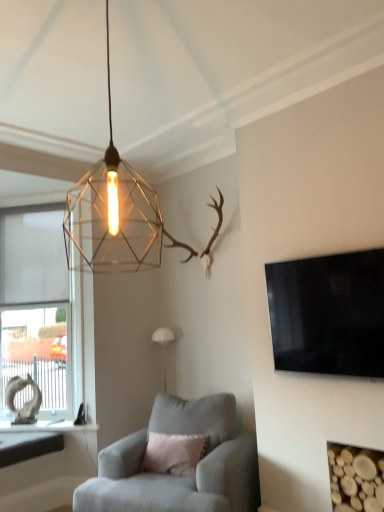
Describe the element at coordinates (38, 309) in the screenshot. The height and width of the screenshot is (512, 384). I see `white matte window at left` at that location.

In order to face metallic wireframe pendant light at upper center, positioned as the 2th lamp in bottom-to-top order, should I rotate leftwards or rightwards?

A 11.670 degree turn to the left will do.

The height and width of the screenshot is (512, 384). I want to click on wooden logs at lower right, so click(x=355, y=478).

The height and width of the screenshot is (512, 384). Find the location of `black glossy flat-screen tv at right`. black glossy flat-screen tv at right is located at coordinates (328, 314).

You are a GUI agent. You are given a task and a screenshot of the screen. Output one action in this format:
    pyautogui.click(x=<x>, y=<y>)
    Task: Click on the suede gray armchair at center
    This screenshot has height=512, width=384.
    Given the screenshot: What is the action you would take?
    pyautogui.click(x=178, y=466)

Locate an element on the screen. This screenshot has width=384, height=512. white matte window at left is located at coordinates (38, 309).

Would you say white matte lamp at center, which appears as the 1th lamp when ordered from the bottom, is part of white matte window at left's contents?

No.

Is white matte window at left to the left or to the right of white matte lamp at center, which appears as the 1th lamp when ordered from the bottom, in the image?

Clearly, white matte window at left is on the left of white matte lamp at center, which appears as the 1th lamp when ordered from the bottom, in the image.

In the scene shown: Which is less distant, (67, 365) or (163, 362)?

Point (67, 365) appears to be closer to the viewer than point (163, 362).

Is metallic wireframe pendant light at upper center, positioned as the 2th lamp in bottom-to-top order, located within black glossy flat-screen tv at right?

No, metallic wireframe pendant light at upper center, positioned as the 2th lamp in bottom-to-top order, is not a part of black glossy flat-screen tv at right.

Is black glossy flat-screen tv at right to the left or to the right of metallic wireframe pendant light at upper center, positioned as the 2th lamp in bottom-to-top order, in the image?

Based on their positions, black glossy flat-screen tv at right is located to the right of metallic wireframe pendant light at upper center, positioned as the 2th lamp in bottom-to-top order.

From the picture: Does black glossy flat-screen tv at right turn towards metallic wireframe pendant light at upper center, which is counted as the first lamp, starting from the front?

Yes, black glossy flat-screen tv at right is oriented towards metallic wireframe pendant light at upper center, which is counted as the first lamp, starting from the front.

From the image's perspective, is black glossy flat-screen tv at right located above or below metallic wireframe pendant light at upper center, the 1th lamp viewed from the top?

Based on their image positions, black glossy flat-screen tv at right is located beneath metallic wireframe pendant light at upper center, the 1th lamp viewed from the top.

Considering the relative sizes of white matte window at left and metallic wireframe pendant light at upper center, acting as the 2th lamp starting from the back, in the image provided, is white matte window at left thinner than metallic wireframe pendant light at upper center, acting as the 2th lamp starting from the back,?

Yes.

Does white matte window at left have a larger size compared to metallic wireframe pendant light at upper center, positioned as the 2th lamp in bottom-to-top order?

Correct, white matte window at left is larger in size than metallic wireframe pendant light at upper center, positioned as the 2th lamp in bottom-to-top order.

Looking at this image, which is closer to the camera, (33, 357) or (111, 244)?

The point (111, 244) is more forward.

In the image, is white matte window at left on the left side or the right side of metallic wireframe pendant light at upper center, the 1th lamp viewed from the top?

In the image, white matte window at left appears on the left side of metallic wireframe pendant light at upper center, the 1th lamp viewed from the top.

Consider the image. What's the angular difference between suede gray armchair at center and metallic wireframe pendant light at upper center, positioned as the 2th lamp in bottom-to-top order,'s facing directions?

The angle between the facing direction of suede gray armchair at center and the facing direction of metallic wireframe pendant light at upper center, positioned as the 2th lamp in bottom-to-top order, is 19.4 degrees.

Is suede gray armchair at center oriented away from metallic wireframe pendant light at upper center, acting as the 2th lamp starting from the back?

No, suede gray armchair at center is not facing the opposite direction of metallic wireframe pendant light at upper center, acting as the 2th lamp starting from the back.

Between suede gray armchair at center and metallic wireframe pendant light at upper center, which is counted as the first lamp, starting from the front, which one is positioned in front?

metallic wireframe pendant light at upper center, which is counted as the first lamp, starting from the front, is closer to the camera.

From a real-world perspective, which is physically below, suede gray armchair at center or metallic wireframe pendant light at upper center, positioned as the 2th lamp in bottom-to-top order?

From a 3D spatial view, suede gray armchair at center is below.

Does wooden logs at lower right have a smaller size compared to suede gray armchair at center?

Correct, wooden logs at lower right occupies less space than suede gray armchair at center.

Looking at this image, which object is more forward, wooden logs at lower right or suede gray armchair at center?

wooden logs at lower right is more forward.

Does wooden logs at lower right have a lesser width compared to suede gray armchair at center?

Yes, wooden logs at lower right is thinner than suede gray armchair at center.

From a real-world perspective, between wooden logs at lower right and suede gray armchair at center, who is vertically higher?

wooden logs at lower right.

Is white matte lamp at center, arranged as the first lamp when viewed from the back, turned away from suede gray armchair at center?

No, white matte lamp at center, arranged as the first lamp when viewed from the back, is not facing the opposite direction of suede gray armchair at center.

Identify the location of chair below the white matte lamp at center, placed as the 2th lamp when sorted from top to bottom (from the image's perspective). This screenshot has height=512, width=384. (178, 466).

Considering the sizes of white matte lamp at center, placed as the 2th lamp when sorted from top to bottom, and suede gray armchair at center in the image, is white matte lamp at center, placed as the 2th lamp when sorted from top to bottom, bigger or smaller than suede gray armchair at center?

In the image, white matte lamp at center, placed as the 2th lamp when sorted from top to bottom, appears to be smaller than suede gray armchair at center.

Considering the relative positions of white matte lamp at center, which appears as the 1th lamp when ordered from the bottom, and suede gray armchair at center in the image provided, is white matte lamp at center, which appears as the 1th lamp when ordered from the bottom, in front of suede gray armchair at center?

That is False.

The width and height of the screenshot is (384, 512). What are the coordinates of `lamp that is the 1st one when counting leftward from the wooden logs at lower right` in the screenshot? It's located at (163, 345).

Which of these two, wooden logs at lower right or white matte lamp at center, arranged as the first lamp when viewed from the back, stands shorter?

With less height is wooden logs at lower right.

Can white matte lamp at center, placed as the 2th lamp when sorted from top to bottom, be found inside wooden logs at lower right?

Definitely not — white matte lamp at center, placed as the 2th lamp when sorted from top to bottom, is not inside wooden logs at lower right.

Based on their positions, is wooden logs at lower right located to the left or right of white matte lamp at center, placed as the 2th lamp when sorted from top to bottom?

Based on their positions, wooden logs at lower right is located to the right of white matte lamp at center, placed as the 2th lamp when sorted from top to bottom.

The image size is (384, 512). I want to click on window that is in front of the white matte lamp at center, placed as the 2th lamp when sorted from top to bottom, so click(38, 309).

Identify the location of television below the metallic wireframe pendant light at upper center, the 1th lamp viewed from the top (from a real-world perspective). The width and height of the screenshot is (384, 512). (328, 314).

Estimate the real-world distances between objects in this image. Which object is further from white matte lamp at center, placed as the 2th lamp when sorted from top to bottom, suede gray armchair at center or metallic wireframe pendant light at upper center, which is counted as the first lamp, starting from the front?

metallic wireframe pendant light at upper center, which is counted as the first lamp, starting from the front, is further to white matte lamp at center, placed as the 2th lamp when sorted from top to bottom.

Estimate the real-world distances between objects in this image. Which object is further from wooden logs at lower right, metallic wireframe pendant light at upper center, which is counted as the first lamp, starting from the front, or suede gray armchair at center?

metallic wireframe pendant light at upper center, which is counted as the first lamp, starting from the front, is further to wooden logs at lower right.

From the image, which object appears to be nearer to suede gray armchair at center, white matte window at left or white matte lamp at center, which appears as the 1th lamp when ordered from the bottom?

white matte lamp at center, which appears as the 1th lamp when ordered from the bottom, is closer to suede gray armchair at center.

Based on their spatial positions, is suede gray armchair at center or wooden logs at lower right closer to white matte window at left?

The object closer to white matte window at left is suede gray armchair at center.

When comparing their distances from white matte lamp at center, which appears as the 1th lamp when ordered from the bottom, does black glossy flat-screen tv at right or suede gray armchair at center seem further?

black glossy flat-screen tv at right is positioned further to the anchor white matte lamp at center, which appears as the 1th lamp when ordered from the bottom.

Considering their positions, is suede gray armchair at center positioned closer to black glossy flat-screen tv at right than metallic wireframe pendant light at upper center, which is counted as the first lamp, starting from the front?

suede gray armchair at center.

Which object lies further to the anchor point metallic wireframe pendant light at upper center, positioned as the 2th lamp in bottom-to-top order, white matte window at left or black glossy flat-screen tv at right?

white matte window at left.

Estimate the real-world distances between objects in this image. Which object is further from wooden logs at lower right, suede gray armchair at center or metallic wireframe pendant light at upper center, acting as the 2th lamp starting from the back?

metallic wireframe pendant light at upper center, acting as the 2th lamp starting from the back, is further to wooden logs at lower right.

Identify the location of chair located between metallic wireframe pendant light at upper center, acting as the 2th lamp starting from the back, and white matte window at left in the depth direction. point(178,466).

Where is `chair between metallic wireframe pendant light at upper center, acting as the 2th lamp starting from the back, and white matte lamp at center, the second lamp in the front-to-back sequence, from front to back`? chair between metallic wireframe pendant light at upper center, acting as the 2th lamp starting from the back, and white matte lamp at center, the second lamp in the front-to-back sequence, from front to back is located at coordinates (178, 466).

At what (x,y) coordinates should I click in order to perform the action: click on chair located between wooden logs at lower right and white matte lamp at center, placed as the 2th lamp when sorted from top to bottom, in the depth direction. Please return your answer as a coordinate pair (x, y). Looking at the image, I should click on (178, 466).

Locate an element on the screen. The height and width of the screenshot is (512, 384). fireplace that lies between black glossy flat-screen tv at right and suede gray armchair at center from top to bottom is located at coordinates (355, 478).